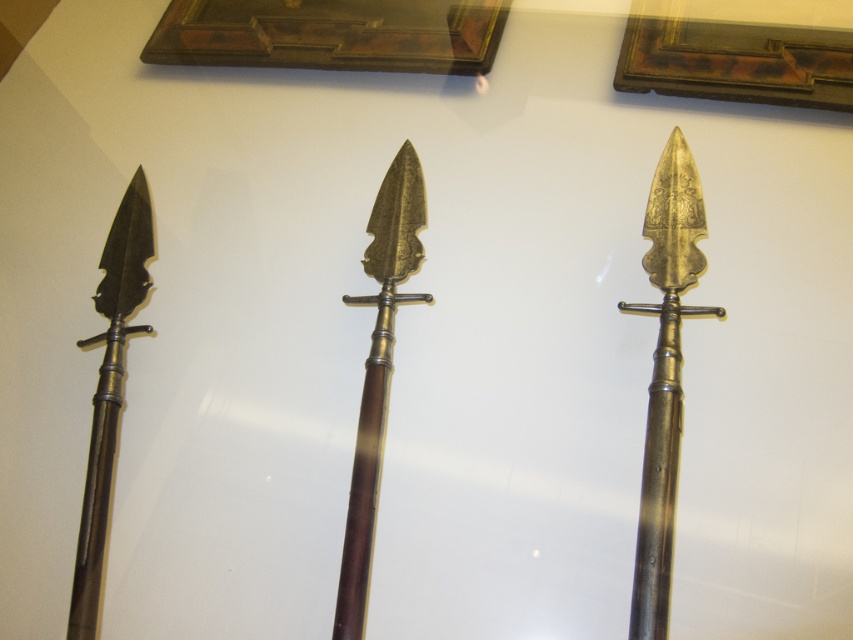
You are a museum curator arranging an exhibit. You have a display case that can only accommodate items up to 1.5 meters in height. You need to place both the gold polished metal spear at center and the matte black spear at left in the case. Based on their heights, will both spears fit within the display case?

The gold polished metal spear at center is taller than the matte black spear at left. Since the display case can hold up to 1.5 meters, both spears will fit only if the tallest one, the gold polished metal spear at center, is under 1.5 meters. However, without specific measurements, we can only confirm that the matte black spear at left is shorter than the gold one. If the gold spear is within the limit, both will fit.

You are a museum curator planning to arrange these spears in a display case. The case has a width of 1.2 meters. The gold polished spear at right is currently positioned to the right side of the case, and the matte black spear at left is placed to the left side. Given their sizes, do you think there will be enough space between them to accommodate a 0.3 meter wide informational plaque?

The gold polished spear at right is larger in size than the matte black spear at left. Since the case is 1.2 meters wide and the plaque requires 0.3 meters, the remaining space for the spears would be 0.9 meters. However, without knowing the exact dimensions of each spear, it is impossible to determine if there will be sufficient space between them for the plaque.